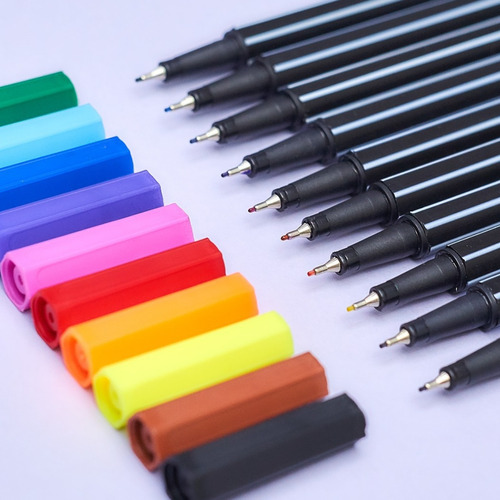
Find the location of a particular element. Image resolution: width=500 pixels, height=500 pixels. pens is located at coordinates (191, 59), (229, 88), (263, 116), (296, 153), (325, 182), (356, 212), (383, 244), (434, 278), (462, 308), (484, 362).